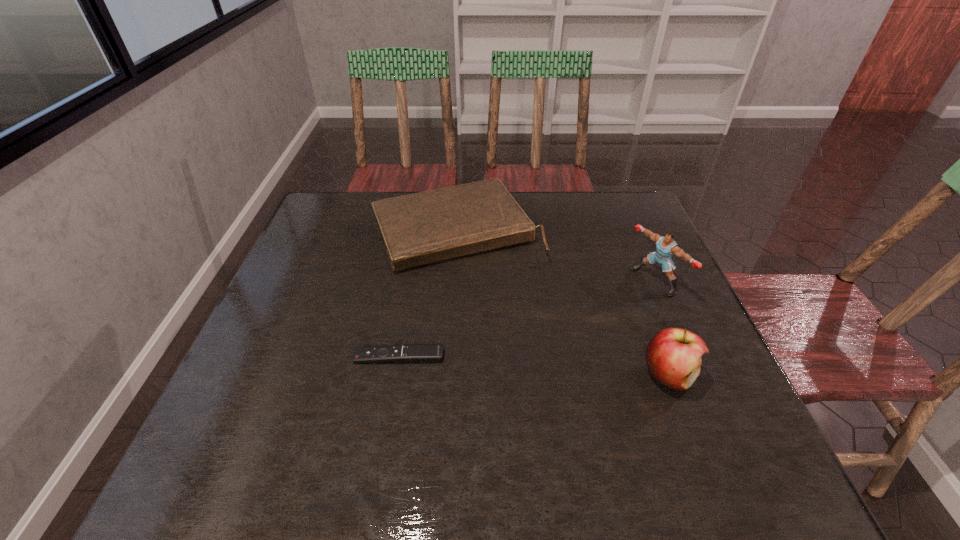
The width and height of the screenshot is (960, 540). I want to click on vacant spot on the desktop that is between the remote control and the third shortest object and is positioned on the front-facing side of the puncher, so click(502, 363).

Where is `free spot on the desktop that is between the remote control and the third shortest object and is positioned on the spine side of the second shortest object`? The width and height of the screenshot is (960, 540). free spot on the desktop that is between the remote control and the third shortest object and is positioned on the spine side of the second shortest object is located at coordinates (533, 366).